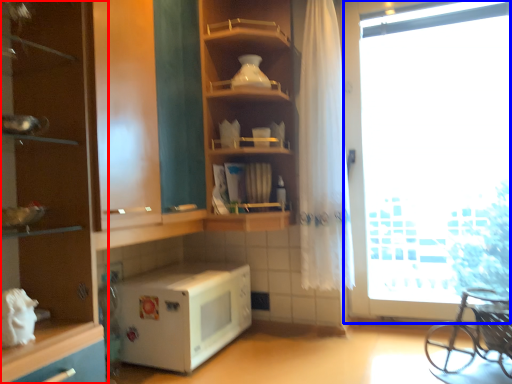
Question: Which object appears closest to the camera in this image, cabinetry (highlighted by a red box) or window (highlighted by a blue box)?

Choices:
 (A) cabinetry
 (B) window

Answer: (A)